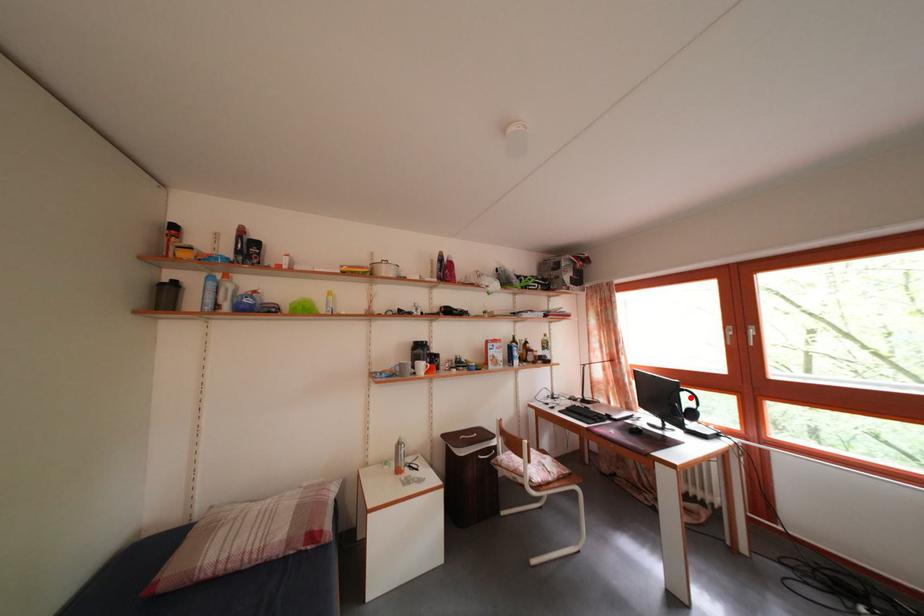
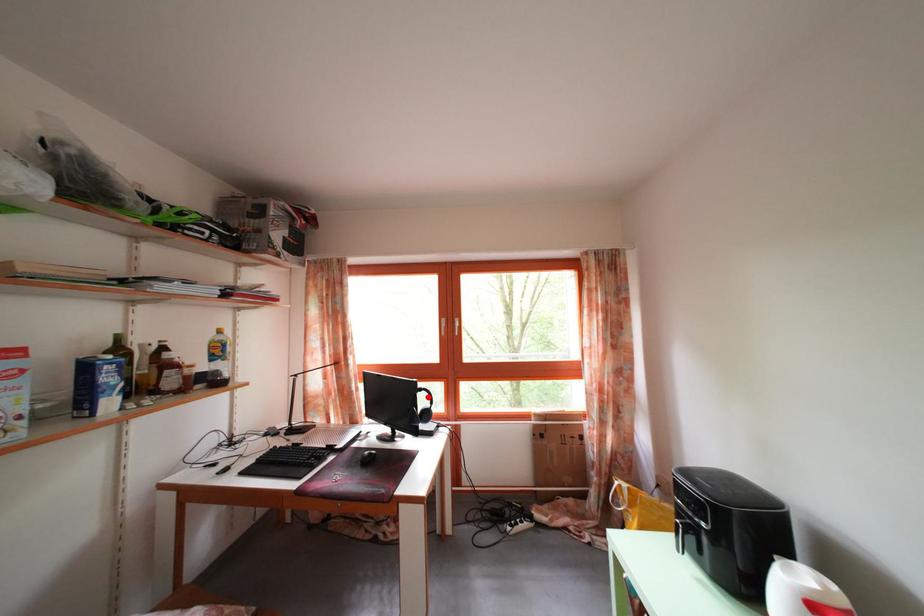
I am providing you with two images of the same scene from different viewpoints. A red point is marked on the first image and another point is marked on the second image. Is the marked point in image1 the same physical position as the marked point in image2?

Yes